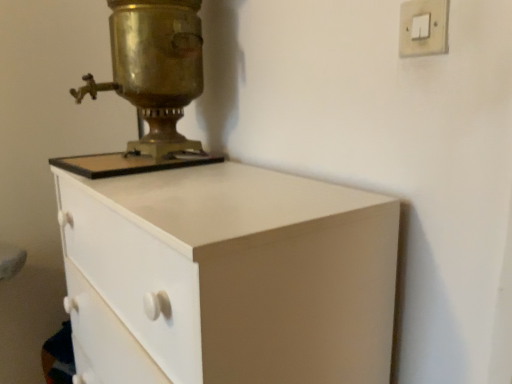
Question: Considering the relative sizes of gold metallic light switch at upper right and white matte chest of drawers at center in the image provided, is gold metallic light switch at upper right smaller than white matte chest of drawers at center?

Choices:
 (A) yes
 (B) no

Answer: (A)

Question: From the image's perspective, would you say gold metallic light switch at upper right is positioned over white matte chest of drawers at center?

Choices:
 (A) yes
 (B) no

Answer: (A)

Question: Does gold metallic light switch at upper right have a greater height compared to white matte chest of drawers at center?

Choices:
 (A) no
 (B) yes

Answer: (A)

Question: From the image's perspective, is gold metallic light switch at upper right below white matte chest of drawers at center?

Choices:
 (A) yes
 (B) no

Answer: (B)

Question: Is gold metallic light switch at upper right in contact with white matte chest of drawers at center?

Choices:
 (A) no
 (B) yes

Answer: (A)

Question: Which is correct: brass/bronze metallic samovar at upper left is inside gold metallic light switch at upper right, or outside of it?

Choices:
 (A) inside
 (B) outside

Answer: (B)

Question: Is point (173, 3) closer or farther from the camera than point (437, 38)?

Choices:
 (A) farther
 (B) closer

Answer: (A)

Question: Considering their positions, is brass/bronze metallic samovar at upper left located in front of or behind gold metallic light switch at upper right?

Choices:
 (A) behind
 (B) front

Answer: (A)

Question: From the image's perspective, is brass/bronze metallic samovar at upper left positioned above or below gold metallic light switch at upper right?

Choices:
 (A) above
 (B) below

Answer: (A)

Question: From the image's perspective, is gold metallic light switch at upper right positioned above or below brass/bronze metallic samovar at upper left?

Choices:
 (A) above
 (B) below

Answer: (B)

Question: Is gold metallic light switch at upper right to the left or to the right of brass/bronze metallic samovar at upper left in the image?

Choices:
 (A) right
 (B) left

Answer: (A)

Question: From a real-world perspective, relative to brass/bronze metallic samovar at upper left, is gold metallic light switch at upper right vertically above or below?

Choices:
 (A) below
 (B) above

Answer: (B)

Question: Based on their sizes in the image, would you say gold metallic light switch at upper right is bigger or smaller than brass/bronze metallic samovar at upper left?

Choices:
 (A) small
 (B) big

Answer: (A)

Question: In terms of width, does white matte chest of drawers at center look wider or thinner when compared to brass/bronze metallic samovar at upper left?

Choices:
 (A) thin
 (B) wide

Answer: (B)

Question: Is white matte chest of drawers at center in front of or behind brass/bronze metallic samovar at upper left in the image?

Choices:
 (A) front
 (B) behind

Answer: (A)